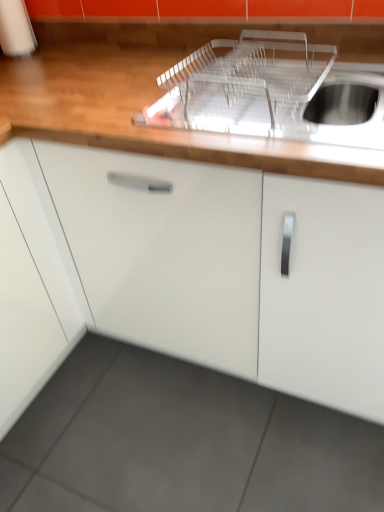
Question: Is transparent plastic dish rack at upper center with white glossy cabinet at center?

Choices:
 (A) yes
 (B) no

Answer: (B)

Question: Does transparent plastic dish rack at upper center contain white glossy cabinet at center?

Choices:
 (A) no
 (B) yes

Answer: (A)

Question: Does transparent plastic dish rack at upper center have a smaller size compared to white glossy cabinet at center?

Choices:
 (A) yes
 (B) no

Answer: (A)

Question: From a real-world perspective, does transparent plastic dish rack at upper center sit lower than white glossy cabinet at center?

Choices:
 (A) yes
 (B) no

Answer: (B)

Question: Is transparent plastic dish rack at upper center facing towards white glossy cabinet at center?

Choices:
 (A) yes
 (B) no

Answer: (A)

Question: Is transparent plastic sink at upper right taller or shorter than transparent plastic dish rack at upper center?

Choices:
 (A) short
 (B) tall

Answer: (A)

Question: Relative to transparent plastic dish rack at upper center, is transparent plastic sink at upper right in front or behind?

Choices:
 (A) front
 (B) behind

Answer: (B)

Question: In terms of size, does transparent plastic sink at upper right appear bigger or smaller than transparent plastic dish rack at upper center?

Choices:
 (A) small
 (B) big

Answer: (A)

Question: Is transparent plastic sink at upper right wider or thinner than transparent plastic dish rack at upper center?

Choices:
 (A) wide
 (B) thin

Answer: (B)

Question: In terms of height, does transparent plastic sink at upper right look taller or shorter compared to white glossy cabinet at center?

Choices:
 (A) tall
 (B) short

Answer: (B)

Question: Would you say transparent plastic sink at upper right is to the left or to the right of white glossy cabinet at center in the picture?

Choices:
 (A) right
 (B) left

Answer: (A)

Question: Is transparent plastic sink at upper right inside or outside of white glossy cabinet at center?

Choices:
 (A) outside
 (B) inside

Answer: (B)

Question: Considering their positions, is transparent plastic sink at upper right located in front of or behind white glossy cabinet at center?

Choices:
 (A) behind
 (B) front

Answer: (A)

Question: In the image, is transparent plastic dish rack at upper center on the left side or the right side of white glossy cabinet at center?

Choices:
 (A) right
 (B) left

Answer: (A)

Question: From the image's perspective, is transparent plastic dish rack at upper center located above or below white glossy cabinet at center?

Choices:
 (A) below
 (B) above

Answer: (B)